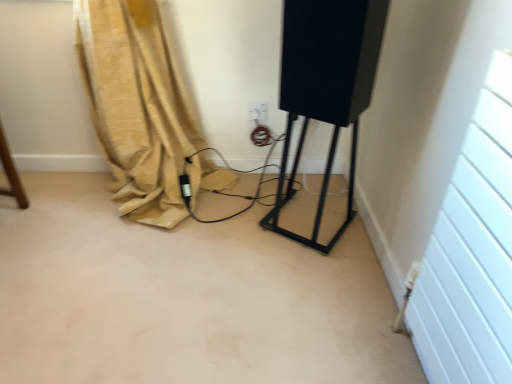
Question: From the image's perspective, relative to white plastic electric outlet at center, is beige fabric curtain at lower left above or below?

Choices:
 (A) below
 (B) above

Answer: (A)

Question: From their relative heights in the image, would you say beige fabric curtain at lower left is taller or shorter than white plastic electric outlet at center?

Choices:
 (A) tall
 (B) short

Answer: (A)

Question: Considering the real-world distances, which object is closest to the black matte speaker at center?

Choices:
 (A) white plastic electric outlet at center
 (B) beige fabric curtain at lower left

Answer: (A)

Question: Based on their relative distances, which object is nearer to the black matte speaker at center?

Choices:
 (A) white plastic electric outlet at center
 (B) beige fabric curtain at lower left

Answer: (A)